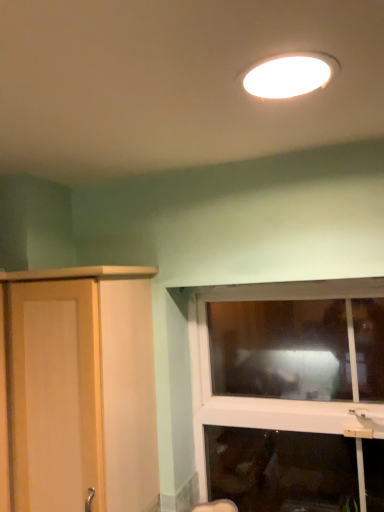
Question: Considering their positions, is light wood cupboard at left located in front of or behind transparent glass window at lower right?

Choices:
 (A) front
 (B) behind

Answer: (A)

Question: From the image's perspective, is light wood cupboard at left above or below transparent glass window at lower right?

Choices:
 (A) below
 (B) above

Answer: (B)

Question: Based on their relative distances, which object is nearer to the white glossy light fixture at upper center?

Choices:
 (A) transparent glass window at lower right
 (B) light wood cupboard at left

Answer: (B)

Question: Which of these objects is positioned farthest from the light wood cupboard at left?

Choices:
 (A) transparent glass window at lower right
 (B) white glossy light fixture at upper center

Answer: (A)